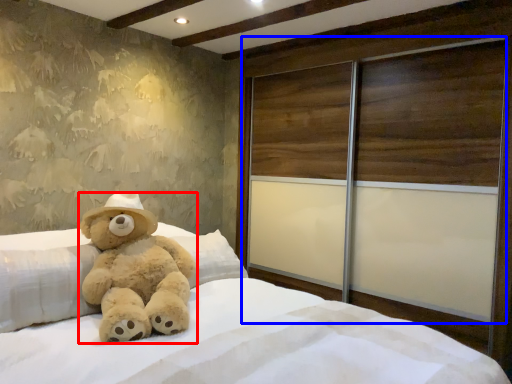
Question: Which of the following is the farthest to the observer, teddy bear (highlighted by a red box) or screen door (highlighted by a blue box)?

Choices:
 (A) teddy bear
 (B) screen door

Answer: (B)